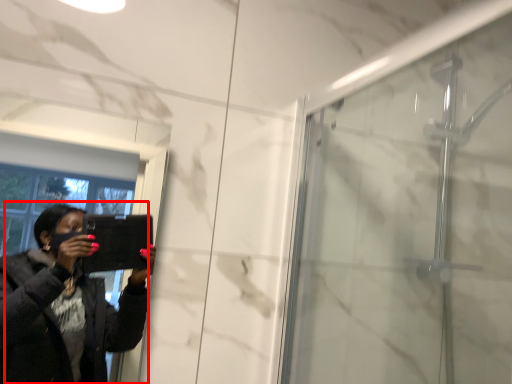
Question: From the image's perspective, what is the correct spatial positioning of woman (annotated by the red box) in reference to screen door?

Choices:
 (A) below
 (B) above

Answer: (A)